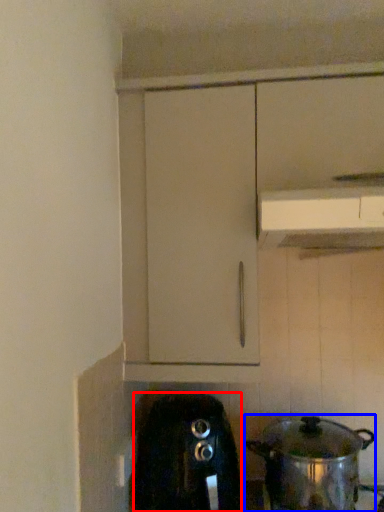
Question: Which point is further to the camera, home appliance (highlighted by a red box) or kitchen appliance (highlighted by a blue box)?

Choices:
 (A) home appliance
 (B) kitchen appliance

Answer: (A)